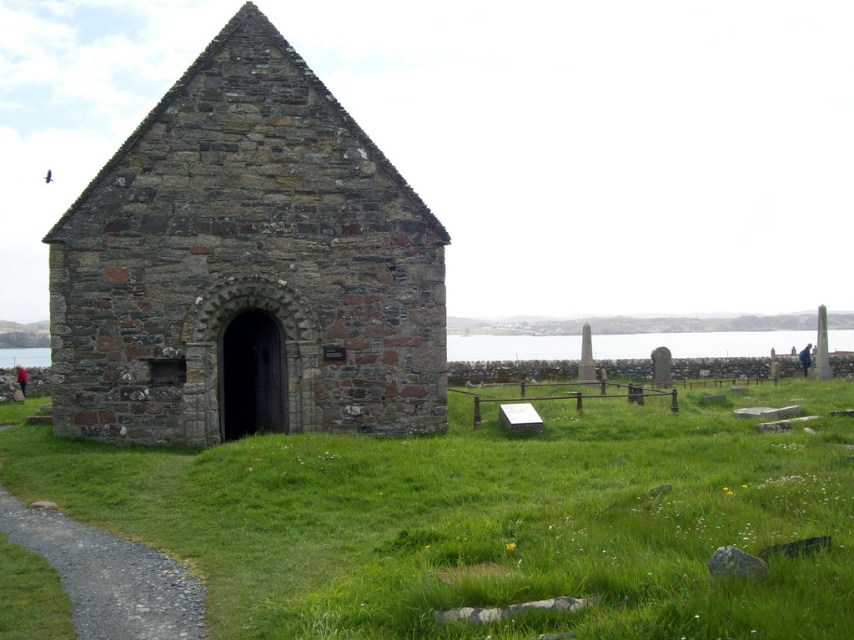
Question: Among these objects, which one is nearest to the camera?

Choices:
 (A) transparent water at center
 (B) green grassy at center

Answer: (B)

Question: Can you confirm if rustic stone church at center is positioned to the left of gravel path at lower left?

Choices:
 (A) yes
 (B) no

Answer: (B)

Question: Which object appears farthest from the camera in this image?

Choices:
 (A) green grassy at center
 (B) transparent water at center
 (C) gravel path at lower left

Answer: (B)

Question: Does rustic stone church at center appear under gravel path at lower left?

Choices:
 (A) yes
 (B) no

Answer: (B)

Question: Among these objects, which one is nearest to the camera?

Choices:
 (A) gravel path at lower left
 (B) rustic stone church at center

Answer: (A)

Question: Does gravel path at lower left appear over transparent water at center?

Choices:
 (A) no
 (B) yes

Answer: (A)